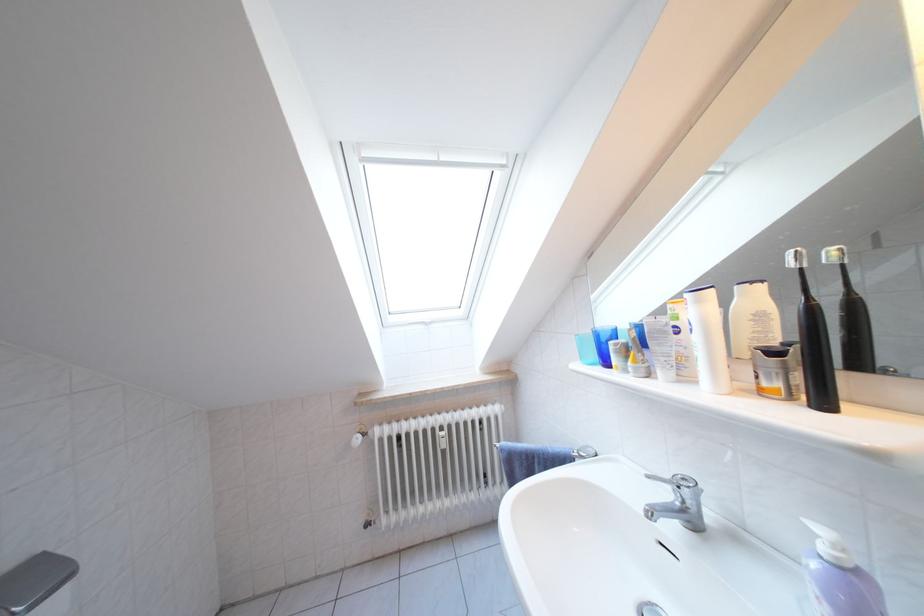
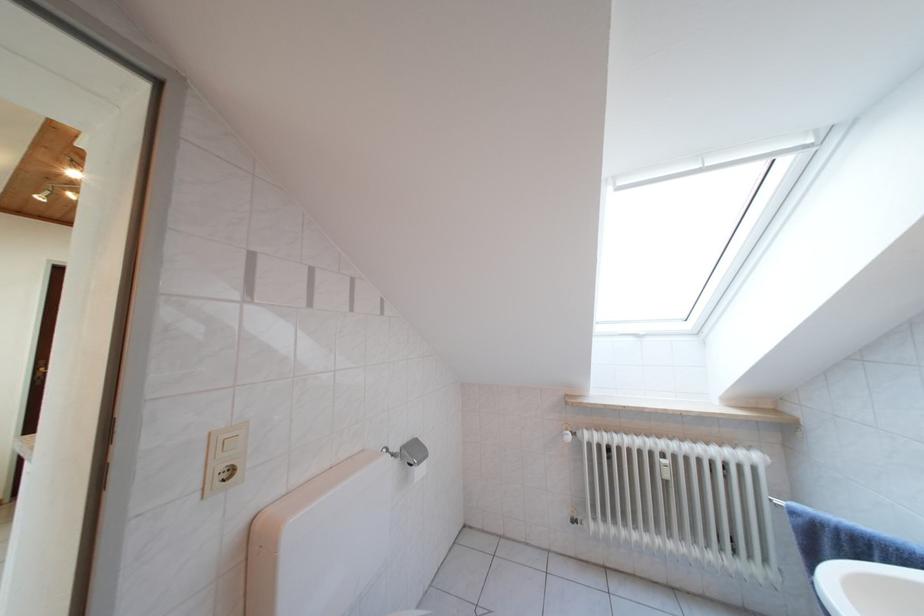
Where in the second image is the point corresponding to [379,438] from the first image?

(588, 439)